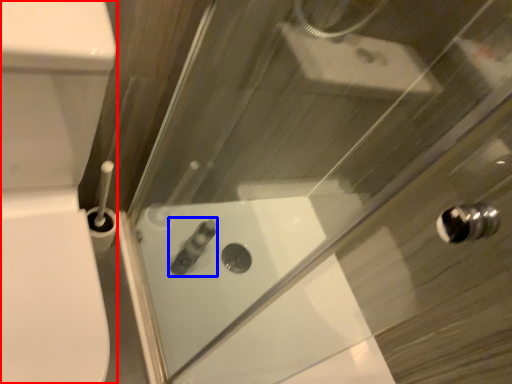
Question: Which point is closer to the camera, porcelain (highlighted by a red box) or toiletry (highlighted by a blue box)?

Choices:
 (A) porcelain
 (B) toiletry

Answer: (A)